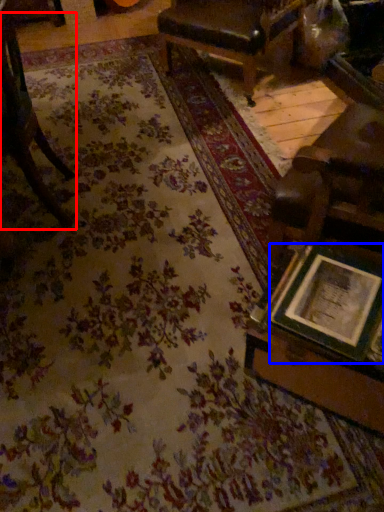
Question: Which point is further to the camera, chair (highlighted by a red box) or picture frame (highlighted by a blue box)?

Choices:
 (A) chair
 (B) picture frame

Answer: (A)